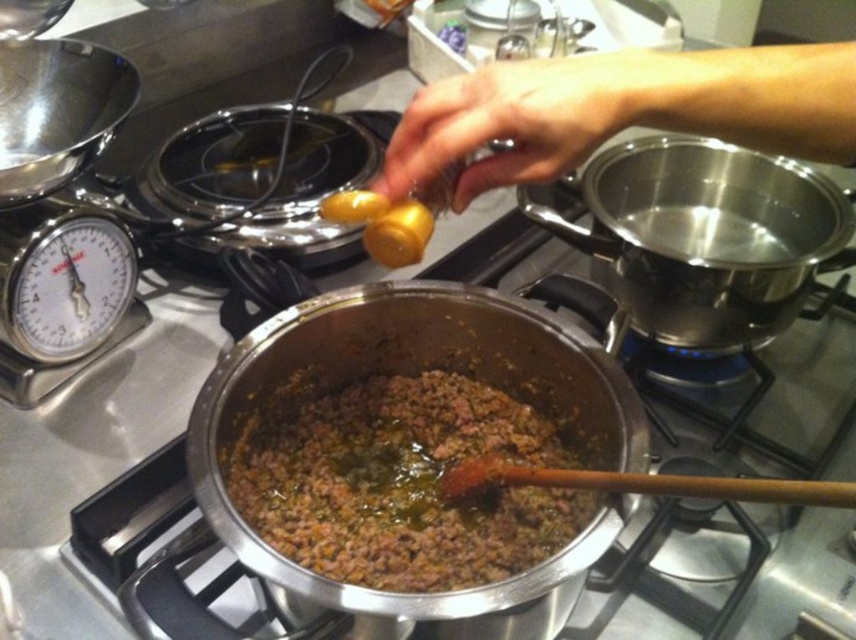
Does point (390, 577) come behind point (550, 122)?

Yes, point (390, 577) is behind point (550, 122).

Who is positioned more to the right, brown matte ground meat at center or smooth yellow mustard at upper center?

smooth yellow mustard at upper center is more to the right.

Who is more forward, (488, 388) or (635, 118)?

Point (635, 118) is more forward.

The height and width of the screenshot is (640, 856). In order to click on brown matte ground meat at center in this screenshot , I will do `click(397, 481)`.